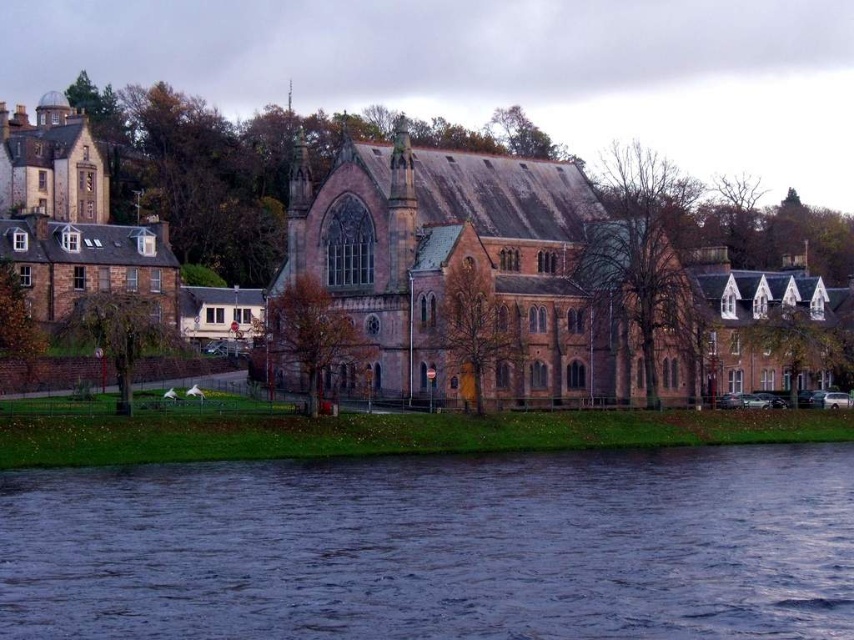
Is point (272, 513) closer to viewer compared to point (676, 364)?

Yes, point (272, 513) is in front of point (676, 364).

Between dark blue water at lower center and brown stone church at center, which one has less height?

dark blue water at lower center

Which is behind, point (600, 636) or point (430, 266)?

The point (430, 266) is behind.

Locate an element on the screen. This screenshot has width=854, height=640. dark blue water at lower center is located at coordinates (437, 547).